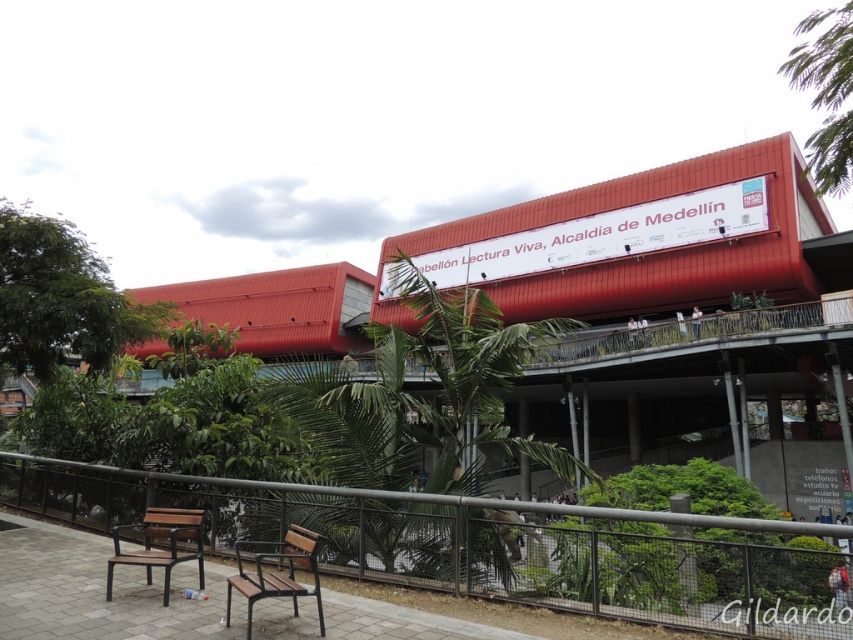
Who is positioned more to the right, metal/rustic fence at lower center or brown wooden bench at lower left?

metal/rustic fence at lower center

Does point (363, 557) come behind point (167, 579)?

Yes.

Measure the distance between point (709,570) and camera.

Point (709,570) is 4.87 meters from camera.

Find the location of `metal/rustic fence at lower center`. metal/rustic fence at lower center is located at coordinates (490, 545).

Can you confirm if metal/rustic fence at lower center is positioned below brown wooden bench at lower center?

Indeed, metal/rustic fence at lower center is positioned under brown wooden bench at lower center.

Where is `metal/rustic fence at lower center`? This screenshot has width=853, height=640. metal/rustic fence at lower center is located at coordinates (490, 545).

Locate an element on the screen. Image resolution: width=853 pixels, height=640 pixels. metal/rustic fence at lower center is located at coordinates (490, 545).

Is brown wooden bench at lower center to the right of brown wooden bench at lower left from the viewer's perspective?

Indeed, brown wooden bench at lower center is positioned on the right side of brown wooden bench at lower left.

Is point (264, 577) positioned before point (201, 528)?

Yes.

Does point (318, 618) come closer to viewer compared to point (172, 529)?

That is True.

You are a GUI agent. You are given a task and a screenshot of the screen. Output one action in this format:
    pyautogui.click(x=<x>, y=<y>)
    Task: Click on the brown wooden bench at lower center
    This screenshot has height=640, width=853.
    Given the screenshot: What is the action you would take?
    pyautogui.click(x=277, y=572)